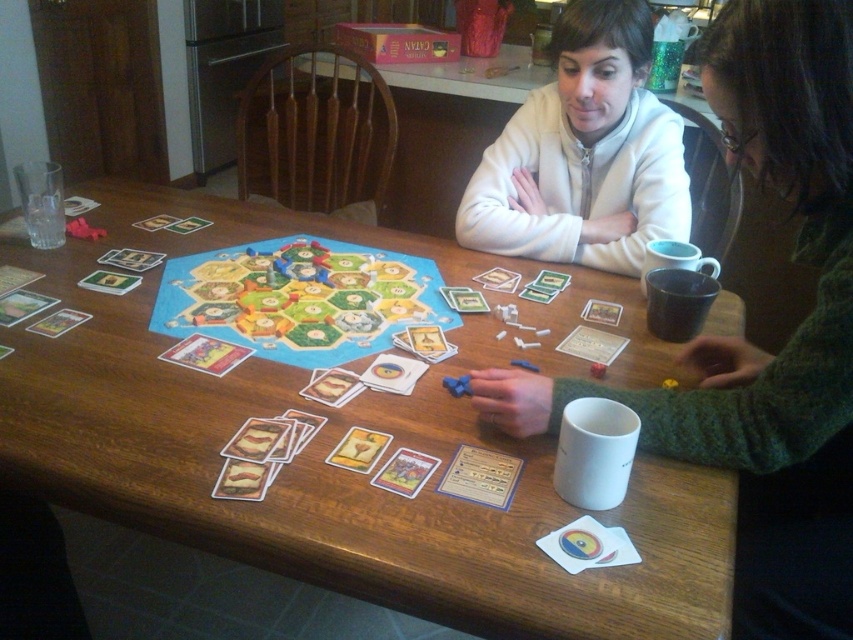
Can you confirm if wooden table at center is bigger than white fleece sweater at upper center?

Indeed, wooden table at center has a larger size compared to white fleece sweater at upper center.

Does wooden table at center lie behind white fleece sweater at upper center?

No, wooden table at center is in front of white fleece sweater at upper center.

Locate an element on the screen. The height and width of the screenshot is (640, 853). wooden table at center is located at coordinates (339, 438).

Is the position of green textured sweater at upper right more distant than that of white fleece sweater at upper center?

No, it is not.

Between point (764, 618) and point (659, 216), which one is positioned in front?

Point (764, 618) is more forward.

Where is `green textured sweater at upper right`? This screenshot has height=640, width=853. green textured sweater at upper right is located at coordinates (751, 344).

Which of these two, wooden table at center or green textured sweater at upper right, stands shorter?

Standing shorter between the two is wooden table at center.

Is point (193, 460) in front of point (680, 417)?

Yes.

You are a GUI agent. You are given a task and a screenshot of the screen. Output one action in this format:
    pyautogui.click(x=<x>, y=<y>)
    Task: Click on the wooden table at center
    
    Given the screenshot: What is the action you would take?
    pyautogui.click(x=339, y=438)